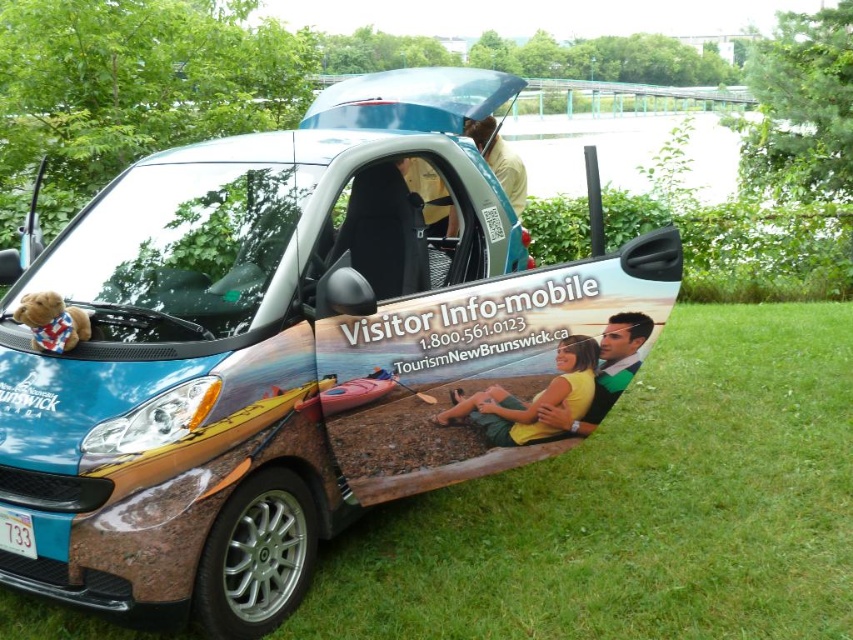
You are standing in a park and see the metallic blue car at center and the light brown leather jacket at upper center. Which object is nearer to you?

The metallic blue car at center is closer to the viewer than the light brown leather jacket at upper center.

You are a photographer trying to capture a photo of the metallic blue car at center and the light brown leather jacket at upper center. Since you want both objects to be clearly visible in the frame, which object should you focus on first to ensure proper focus?

The metallic blue car at center is much taller than the light brown leather jacket at upper center, so you should focus on the metallic blue car at center first as it is larger and more prominent in the scene.

You are a photographer standing in front of the car and want to take a picture of the yellow matte shirt at lower center and the light brown leather jacket at upper center. Which object will appear closer to the camera in the photo?

Answer: The yellow matte shirt at lower center will appear closer to the camera in the photo because it is in front of the light brown leather jacket at upper center.